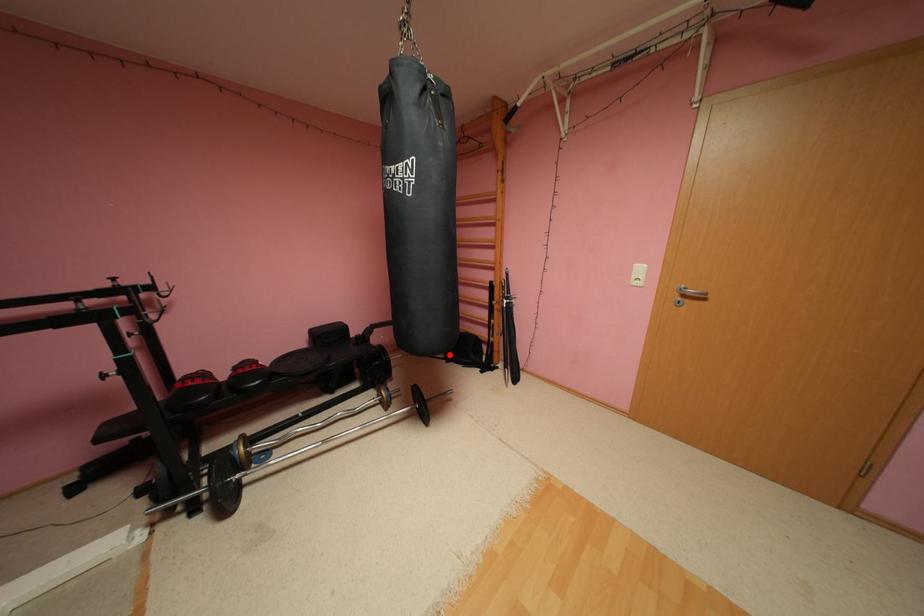
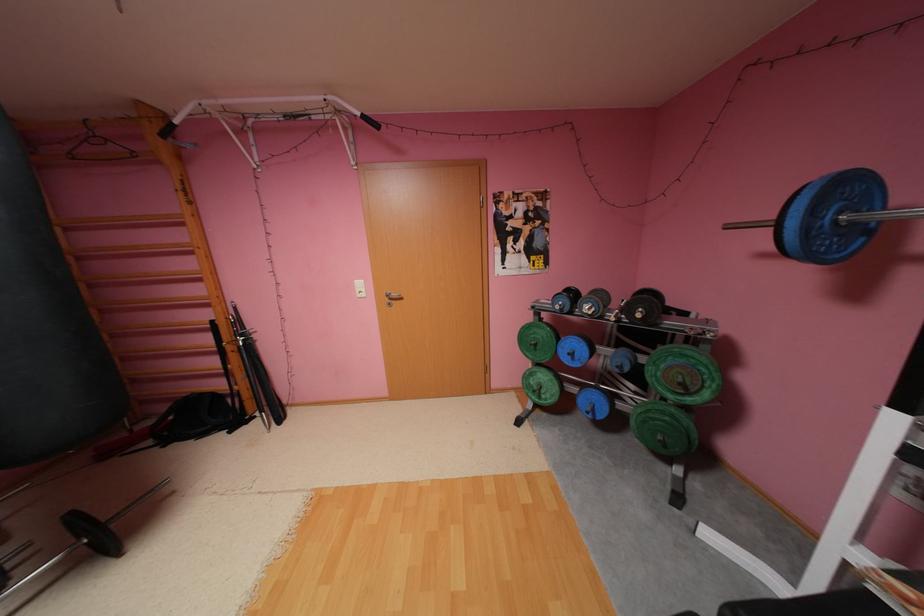
Question: I am providing you with two images of the same scene from different viewpoints. Image1 has a red point marked. In image2, the corresponding 3D location appears at what relative position? Reply with the corresponding letter.

Choices:
 (A) Closer
 (B) Farther

Answer: (A)